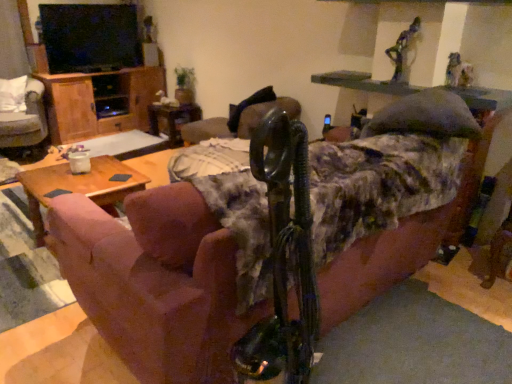
Question: From a real-world perspective, is pink fabric couch at center on top of woodenwoodentable at left?

Choices:
 (A) yes
 (B) no

Answer: (A)

Question: Is pink fabric couch at center not within woodenwoodentable at left?

Choices:
 (A) yes
 (B) no

Answer: (A)

Question: Is pink fabric couch at center to the right of woodenwoodentable at left from the viewer's perspective?

Choices:
 (A) no
 (B) yes

Answer: (B)

Question: Does pink fabric couch at center have a lesser height compared to woodenwoodentable at left?

Choices:
 (A) yes
 (B) no

Answer: (B)

Question: Can you confirm if pink fabric couch at center is taller than woodenwoodentable at left?

Choices:
 (A) no
 (B) yes

Answer: (B)

Question: Could you tell me if pink fabric couch at center is turned towards woodenwoodentable at left?

Choices:
 (A) yes
 (B) no

Answer: (A)

Question: Is pink fabric couch at center facing towards wooden side table at center?

Choices:
 (A) yes
 (B) no

Answer: (A)

Question: Is pink fabric couch at center far away from wooden side table at center?

Choices:
 (A) yes
 (B) no

Answer: (A)

Question: From the image's perspective, is pink fabric couch at center on top of wooden side table at center?

Choices:
 (A) no
 (B) yes

Answer: (A)

Question: Is pink fabric couch at center at the right side of wooden side table at center?

Choices:
 (A) yes
 (B) no

Answer: (A)

Question: Is pink fabric couch at center to the left of wooden side table at center from the viewer's perspective?

Choices:
 (A) no
 (B) yes

Answer: (A)

Question: Can you confirm if pink fabric couch at center is taller than wooden side table at center?

Choices:
 (A) no
 (B) yes

Answer: (B)

Question: Would you consider wooden cabinet at left to be distant from white fabric chair at left, positioned as the second chair in right-to-left order?

Choices:
 (A) no
 (B) yes

Answer: (A)